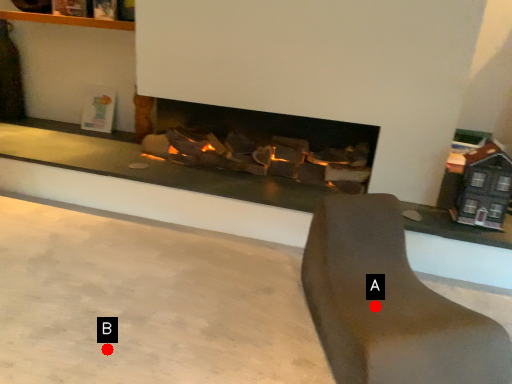
Question: Two points are circled on the image, labeled by A and B beside each circle. Which point is further to the camera?

Choices:
 (A) A is further
 (B) B is further

Answer: (B)